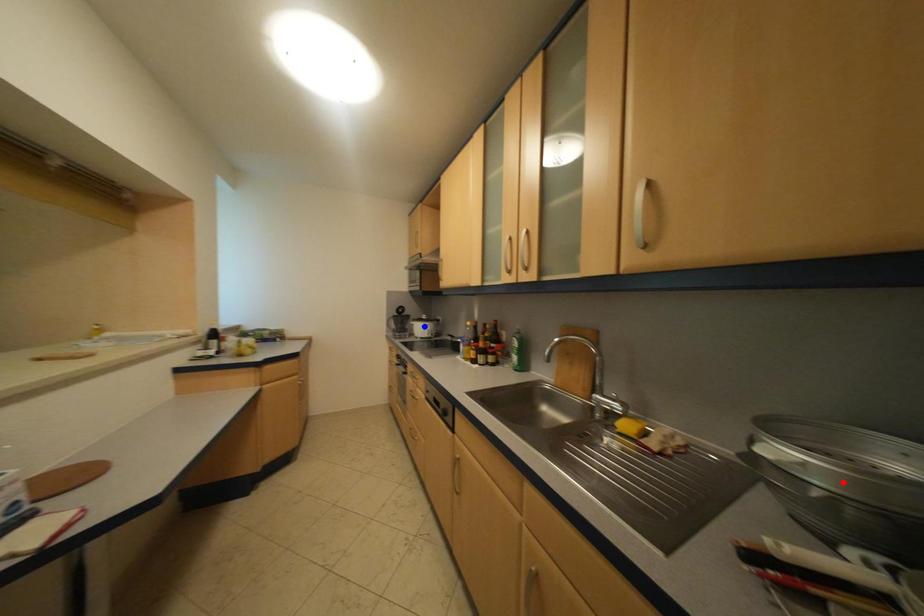
Question: Which of the two points in the image is closer to the camera?

Choices:
 (A) Blue point is closer.
 (B) Red point is closer.

Answer: (B)